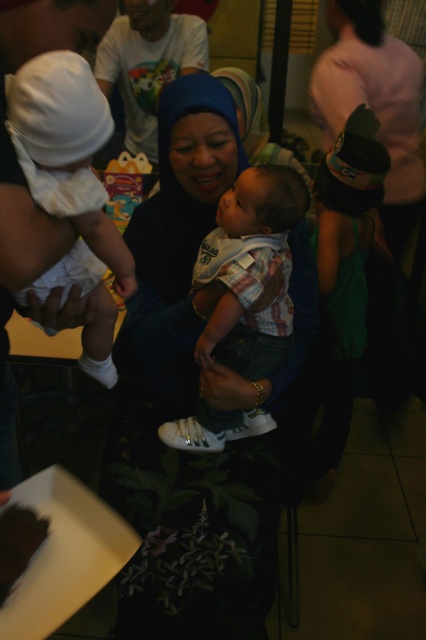
Is point (187, 280) behind point (19, 538)?

That is True.

In the scene shown: Who is positioned more to the right, blue fabric hijab at center or chocolate cake at lower left?

From the viewer's perspective, blue fabric hijab at center appears more on the right side.

I want to click on blue fabric hijab at center, so click(x=172, y=250).

What are the coordinates of `blue fabric hijab at center` in the screenshot? It's located at (172, 250).

Is blue fabric hijab at center to the left of white cotton shirt at upper center from the viewer's perspective?

No, blue fabric hijab at center is not to the left of white cotton shirt at upper center.

Which is behind, point (296, 260) or point (111, 72)?

Point (111, 72)

Is point (135, 236) farther from viewer compared to point (181, 52)?

No.

Where is `blue fabric hijab at center`? Image resolution: width=426 pixels, height=640 pixels. blue fabric hijab at center is located at coordinates (172, 250).

Can you confirm if white cotton hat at left is shorter than chocolate cake at lower left?

No.

Which is below, white cotton hat at left or chocolate cake at lower left?

chocolate cake at lower left is below.

Does point (106, 252) come in front of point (11, 589)?

No, it is not.

This screenshot has height=640, width=426. Find the location of `white cotton hat at left`. white cotton hat at left is located at coordinates (66, 166).